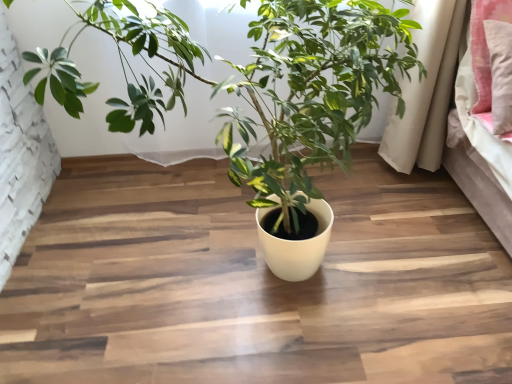
Locate an element on the screen. This screenshot has width=512, height=384. free space underneath yellow matte pot at center (from a real-world perspective) is located at coordinates (217, 258).